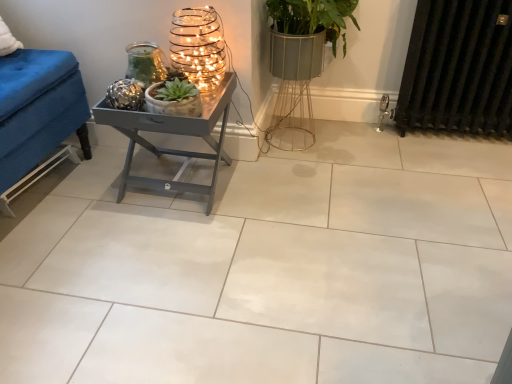
Question: Considering the relative sizes of metallic textured candle holder at upper center, marked as the first candle holder in a left-to-right arrangement, and black metal radiator at right in the image provided, is metallic textured candle holder at upper center, marked as the first candle holder in a left-to-right arrangement, shorter than black metal radiator at right?

Choices:
 (A) no
 (B) yes

Answer: (B)

Question: Can you confirm if metallic textured candle holder at upper center, the 2th candle holder when ordered from right to left, is thinner than black metal radiator at right?

Choices:
 (A) yes
 (B) no

Answer: (A)

Question: Is metallic textured candle holder at upper center, the 2th candle holder when ordered from right to left, turned away from black metal radiator at right?

Choices:
 (A) yes
 (B) no

Answer: (B)

Question: Is metallic textured candle holder at upper center, the 2th candle holder when ordered from right to left, surrounding black metal radiator at right?

Choices:
 (A) yes
 (B) no

Answer: (B)

Question: Can you confirm if metallic textured candle holder at upper center, marked as the first candle holder in a left-to-right arrangement, is positioned to the right of black metal radiator at right?

Choices:
 (A) yes
 (B) no

Answer: (B)

Question: Considering their positions, is metallic textured candle holder at upper center, the 2th candle holder when ordered from right to left, located in front of or behind metallic gray table at center?

Choices:
 (A) behind
 (B) front

Answer: (A)

Question: Which is correct: metallic textured candle holder at upper center, marked as the first candle holder in a left-to-right arrangement, is inside metallic gray table at center, or outside of it?

Choices:
 (A) inside
 (B) outside

Answer: (A)

Question: Is metallic textured candle holder at upper center, the 2th candle holder when ordered from right to left, wider or thinner than metallic gray table at center?

Choices:
 (A) thin
 (B) wide

Answer: (A)

Question: Considering the positions of metallic textured candle holder at upper center, marked as the first candle holder in a left-to-right arrangement, and metallic gray table at center in the image, is metallic textured candle holder at upper center, marked as the first candle holder in a left-to-right arrangement, bigger or smaller than metallic gray table at center?

Choices:
 (A) small
 (B) big

Answer: (A)

Question: Looking at the image, does green matte succulent at center seem bigger or smaller compared to white glossy tile at center?

Choices:
 (A) big
 (B) small

Answer: (B)

Question: Relative to white glossy tile at center, is green matte succulent at center in front or behind?

Choices:
 (A) behind
 (B) front

Answer: (A)

Question: Considering the positions of point (155, 102) and point (116, 150), is point (155, 102) closer or farther from the camera than point (116, 150)?

Choices:
 (A) closer
 (B) farther

Answer: (A)

Question: From the image's perspective, is green matte succulent at center above or below white glossy tile at center?

Choices:
 (A) above
 (B) below

Answer: (A)

Question: In the image, is black metal radiator at right positioned in front of or behind white glossy tile at center?

Choices:
 (A) front
 (B) behind

Answer: (B)

Question: Visually, is black metal radiator at right positioned to the left or to the right of white glossy tile at center?

Choices:
 (A) left
 (B) right

Answer: (B)